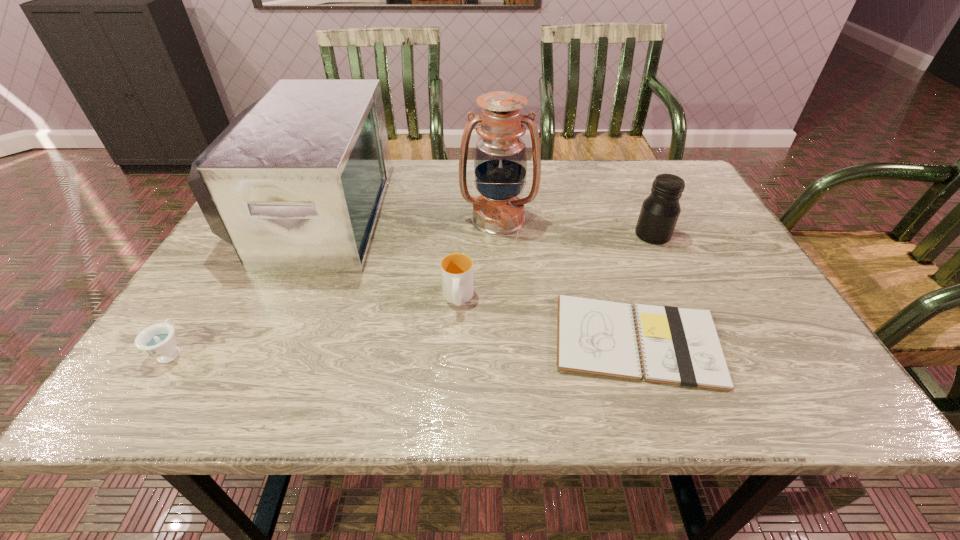
The width and height of the screenshot is (960, 540). What are the coordinates of `empty location between the fifth shortest object and the teacup` in the screenshot? It's located at (244, 282).

Where is `object that is the closest to the shortest object`? The height and width of the screenshot is (540, 960). object that is the closest to the shortest object is located at coordinates (457, 268).

I want to click on object that is the second closest to the microwave oven, so click(457, 268).

Where is `vacant space that satisfies the following two spatial constraints: 1. on the front-facing side of the microwave oven; 2. on the back side of the shortest object`? The width and height of the screenshot is (960, 540). vacant space that satisfies the following two spatial constraints: 1. on the front-facing side of the microwave oven; 2. on the back side of the shortest object is located at coordinates (254, 341).

Find the location of `vacant region that satisfies the following two spatial constraints: 1. on the side of the shortest object with the handle; 2. on the left side of the second shortest object`. vacant region that satisfies the following two spatial constraints: 1. on the side of the shortest object with the handle; 2. on the left side of the second shortest object is located at coordinates (178, 341).

Identify the location of free point that satisfies the following two spatial constraints: 1. on the front-facing side of the second tallest object; 2. on the right side of the shortest object. (254, 341).

The height and width of the screenshot is (540, 960). I want to click on vacant space that satisfies the following two spatial constraints: 1. on the back side of the shortest object; 2. on the front-facing side of the second tallest object, so click(x=594, y=213).

The image size is (960, 540). In order to click on vacant area in the image that satisfies the following two spatial constraints: 1. on the side of the third tallest object with the handle; 2. on the left side of the second shortest object in this screenshot , I will do `click(246, 234)`.

Identify the location of free location that satisfies the following two spatial constraints: 1. on the front-facing side of the microwave oven; 2. on the right side of the fourth shortest object. click(x=305, y=234).